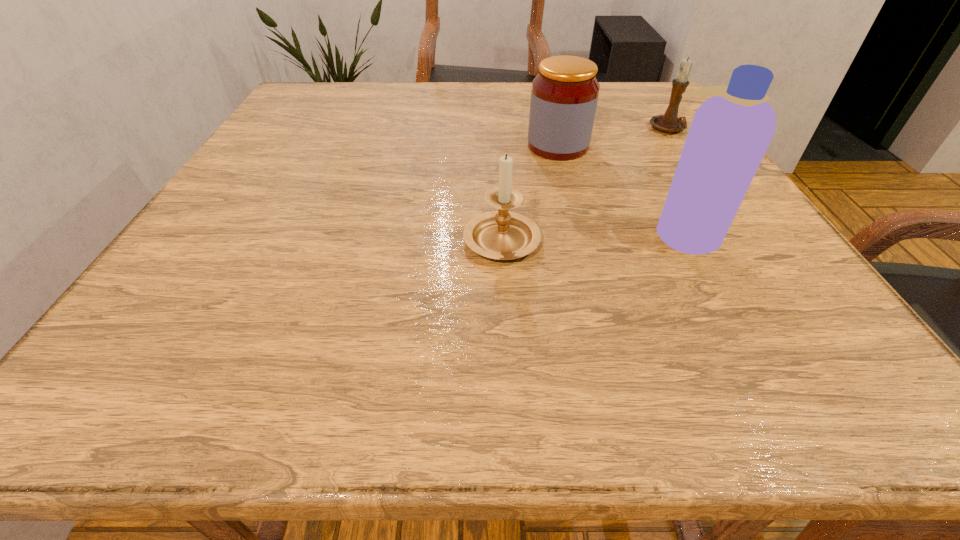
In order to click on shampoo in this screenshot , I will do `click(730, 132)`.

I want to click on the third object from right to left, so click(564, 95).

Where is `the nearer candle holder`? The image size is (960, 540). the nearer candle holder is located at coordinates (502, 235).

The height and width of the screenshot is (540, 960). What are the coordinates of `the leftmost object` in the screenshot? It's located at (502, 235).

This screenshot has width=960, height=540. What are the coordinates of `the right candle holder` in the screenshot? It's located at coord(669,122).

Where is `free space located on the left of the tallest object`? free space located on the left of the tallest object is located at coordinates (558, 233).

Locate an element on the screen. The height and width of the screenshot is (540, 960). free space located on the back of the jar is located at coordinates (541, 83).

Identify the location of vacant region located with a handle on the side of the nearer candle holder. (497, 151).

Locate an element on the screen. free space located 0.360m with a handle on the side of the nearer candle holder is located at coordinates (495, 123).

Identify the location of vacant space positioned with a handle on the side of the nearer candle holder. (495, 130).